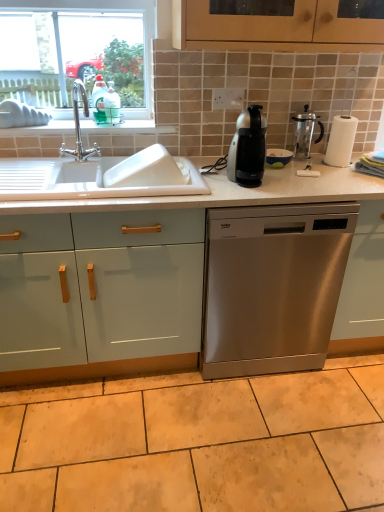
Locate an element on the screen. vacant space in front of satin black coffee machine at center is located at coordinates (247, 194).